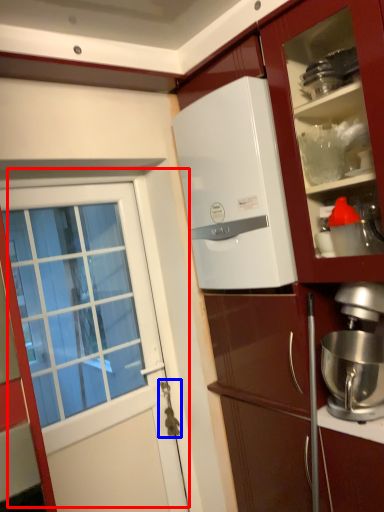
Question: Among these objects, which one is nearest to the camera, door (highlighted by a red box) or door handle (highlighted by a blue box)?

Choices:
 (A) door
 (B) door handle

Answer: (A)